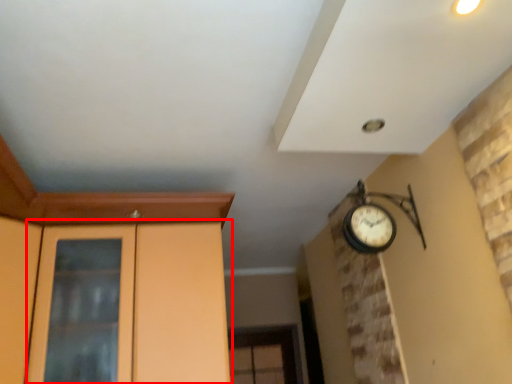
Question: From the image's perspective, considering the relative positions of dresser (annotated by the red box) and door in the image provided, where is dresser (annotated by the red box) located with respect to the staircase?

Choices:
 (A) above
 (B) below

Answer: (B)